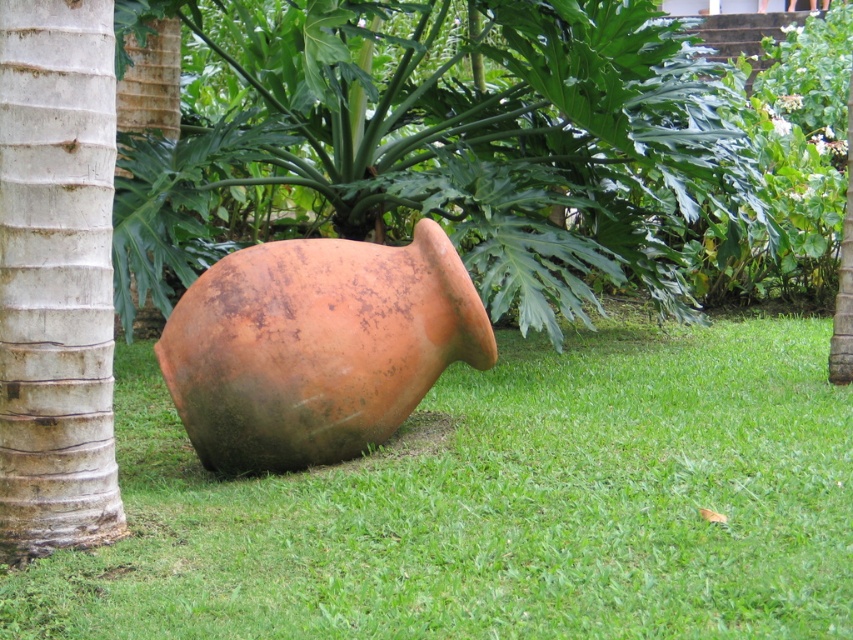
Does white textured tree trunk at left have a lesser width compared to smooth brown bark at left?

Yes.

Can you confirm if white textured tree trunk at left is positioned to the left of smooth brown bark at left?

No, white textured tree trunk at left is not to the left of smooth brown bark at left.

Between point (15, 193) and point (177, 97), which one is positioned in front?

Positioned in front is point (15, 193).

This screenshot has width=853, height=640. I want to click on white textured tree trunk at left, so click(x=56, y=276).

Is green grass at lower center to the right of white textured tree trunk at left from the viewer's perspective?

Indeed, green grass at lower center is positioned on the right side of white textured tree trunk at left.

Does point (543, 632) come farther from viewer compared to point (80, 400)?

No, (543, 632) is in front of (80, 400).

Image resolution: width=853 pixels, height=640 pixels. I want to click on green grass at lower center, so click(x=498, y=506).

Who is taller, green grass at lower center or brown matte coconut tree at center?

Standing taller between the two is brown matte coconut tree at center.

Can you confirm if green grass at lower center is smaller than brown matte coconut tree at center?

Yes, green grass at lower center is smaller than brown matte coconut tree at center.

Locate an element on the screen. This screenshot has height=640, width=853. green grass at lower center is located at coordinates (498, 506).

I want to click on green grass at lower center, so click(x=498, y=506).